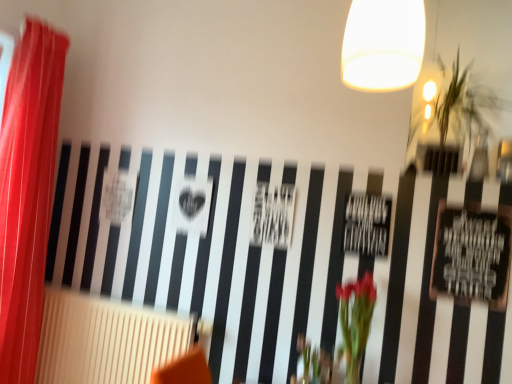
Based on the photo, what is the approximate height of green leafy vase at center?

green leafy vase at center is 50.96 centimeters tall.

Measure the distance between green leafy vase at center and camera.

The depth of green leafy vase at center is 5.75 feet.

Describe the element at coordinates (27, 192) in the screenshot. The image size is (512, 384). I see `red sheer curtain at left` at that location.

Identify the location of green leafy vase at center. Image resolution: width=512 pixels, height=384 pixels. (356, 321).

From the image's perspective, which one is positioned higher, red sheer curtain at left or green leafy vase at center?

red sheer curtain at left, from the image's perspective.

Which of these two, red sheer curtain at left or green leafy vase at center, is smaller?

green leafy vase at center is smaller.

Does point (32, 49) come farther from viewer compared to point (367, 323)?

Yes, point (32, 49) is farther from viewer.

Considering the relative positions of red sheer curtain at left and green leafy vase at center in the image provided, is red sheer curtain at left to the right of green leafy vase at center from the viewer's perspective?

Incorrect, red sheer curtain at left is not on the right side of green leafy vase at center.

Identify the location of floral arrangement below the green leafy plant at upper right (from the image's perspective). The image size is (512, 384). (356, 321).

Can you confirm if green leafy plant at upper right is wider than green leafy vase at center?

Correct, the width of green leafy plant at upper right exceeds that of green leafy vase at center.

Is green leafy plant at upper right aimed at green leafy vase at center?

No, green leafy plant at upper right is not turned towards green leafy vase at center.

Is green leafy plant at upper right surrounding green leafy vase at center?

Actually, green leafy vase at center is outside green leafy plant at upper right.

Are green leafy vase at center and green leafy plant at upper right located far from each other?

No, green leafy vase at center is not far away from green leafy plant at upper right.

Where is `plant above the green leafy vase at center (from the image's perspective)`? This screenshot has width=512, height=384. plant above the green leafy vase at center (from the image's perspective) is located at coordinates (454, 114).

Is green leafy plant at upper right located within green leafy vase at center?

Definitely not — green leafy plant at upper right is not inside green leafy vase at center.

Considering the relative sizes of green leafy vase at center and green leafy plant at upper right in the image provided, is green leafy vase at center thinner than green leafy plant at upper right?

Indeed, green leafy vase at center has a lesser width compared to green leafy plant at upper right.

From a real-world perspective, between green leafy plant at upper right and beige textured radiator at lower left, who is vertically lower?

From a 3D spatial view, beige textured radiator at lower left is below.

Are green leafy plant at upper right and beige textured radiator at lower left beside each other?

No, green leafy plant at upper right is not beside beige textured radiator at lower left.

Is green leafy plant at upper right not inside beige textured radiator at lower left?

That's correct, green leafy plant at upper right is outside of beige textured radiator at lower left.

Identify the location of floral arrangement located in front of the red sheer curtain at left. This screenshot has height=384, width=512. (356, 321).

How distant is green leafy vase at center from red sheer curtain at left?

green leafy vase at center and red sheer curtain at left are 1.63 meters apart from each other.

Relative to red sheer curtain at left, is green leafy vase at center in front or behind?

Clearly, green leafy vase at center is in front of red sheer curtain at left.

Considering the points (346, 349) and (14, 344), which point is in front, point (346, 349) or point (14, 344)?

The point (346, 349) is in front.

Does green leafy vase at center lie in front of beige textured radiator at lower left?

Yes, it is in front of beige textured radiator at lower left.

Can beige textured radiator at lower left be found inside green leafy vase at center?

Actually, beige textured radiator at lower left is outside green leafy vase at center.

Between point (353, 320) and point (149, 373), which one is positioned in front?

Point (353, 320)

How different are the orientations of green leafy vase at center and beige textured radiator at lower left in degrees?

green leafy vase at center and beige textured radiator at lower left are facing 0.164 degrees away from each other.

I want to click on curtain in front of the beige textured radiator at lower left, so click(x=27, y=192).

From a real-world perspective, is beige textured radiator at lower left over red sheer curtain at left?

No, from a real-world perspective, beige textured radiator at lower left is not over red sheer curtain at left

From the image's perspective, does beige textured radiator at lower left appear lower than red sheer curtain at left?

Yes, from the image's perspective, beige textured radiator at lower left is beneath red sheer curtain at left.

Considering the sizes of beige textured radiator at lower left and red sheer curtain at left in the image, is beige textured radiator at lower left wider or thinner than red sheer curtain at left?

Clearly, beige textured radiator at lower left has less width compared to red sheer curtain at left.

What are the coordinates of `curtain above the green leafy vase at center (from a real-world perspective)` in the screenshot? It's located at (27, 192).

Image resolution: width=512 pixels, height=384 pixels. I want to click on plant on the right of green leafy vase at center, so click(454, 114).

Considering their positions, is red sheer curtain at left positioned closer to green leafy plant at upper right than green leafy vase at center?

green leafy vase at center.

Estimate the real-world distances between objects in this image. Which object is further from green leafy vase at center, green leafy plant at upper right or red sheer curtain at left?

red sheer curtain at left is positioned further to the anchor green leafy vase at center.

Estimate the real-world distances between objects in this image. Which object is closer to beige textured radiator at lower left, red sheer curtain at left or green leafy plant at upper right?

red sheer curtain at left lies closer to beige textured radiator at lower left than the other object.

When comparing their distances from beige textured radiator at lower left, does red sheer curtain at left or green leafy vase at center seem closer?

Based on the image, red sheer curtain at left appears to be nearer to beige textured radiator at lower left.

From the image, which object appears to be farther from green leafy vase at center, beige textured radiator at lower left or green leafy plant at upper right?

beige textured radiator at lower left is further to green leafy vase at center.

Considering their positions, is beige textured radiator at lower left positioned closer to green leafy vase at center than red sheer curtain at left?

beige textured radiator at lower left.

Estimate the real-world distances between objects in this image. Which object is further from green leafy vase at center, red sheer curtain at left or green leafy plant at upper right?

Based on the image, red sheer curtain at left appears to be further to green leafy vase at center.

Based on their spatial positions, is red sheer curtain at left or beige textured radiator at lower left closer to green leafy plant at upper right?

Based on the image, beige textured radiator at lower left appears to be nearer to green leafy plant at upper right.

Locate an element on the screen. radiator between red sheer curtain at left and green leafy plant at upper right in the horizontal direction is located at coordinates tap(106, 339).

Where is `floral arrangement located between beige textured radiator at lower left and green leafy plant at upper right in the left-right direction`? floral arrangement located between beige textured radiator at lower left and green leafy plant at upper right in the left-right direction is located at coordinates (356, 321).

Find the location of a particular element. radiator between red sheer curtain at left and green leafy vase at center in the horizontal direction is located at coordinates (106, 339).

Locate an element on the screen. Image resolution: width=512 pixels, height=384 pixels. floral arrangement between red sheer curtain at left and green leafy plant at upper right in the horizontal direction is located at coordinates (356, 321).